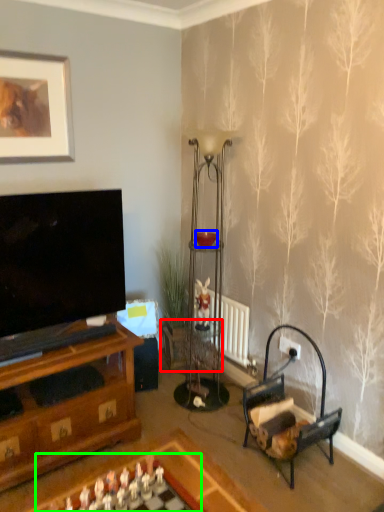
Question: Based on their relative distances, which object is nearer to side table (highlighted by a red box)? Choose from candle holder (highlighted by a blue box) and board game (highlighted by a green box).

Choices:
 (A) candle holder
 (B) board game

Answer: (A)